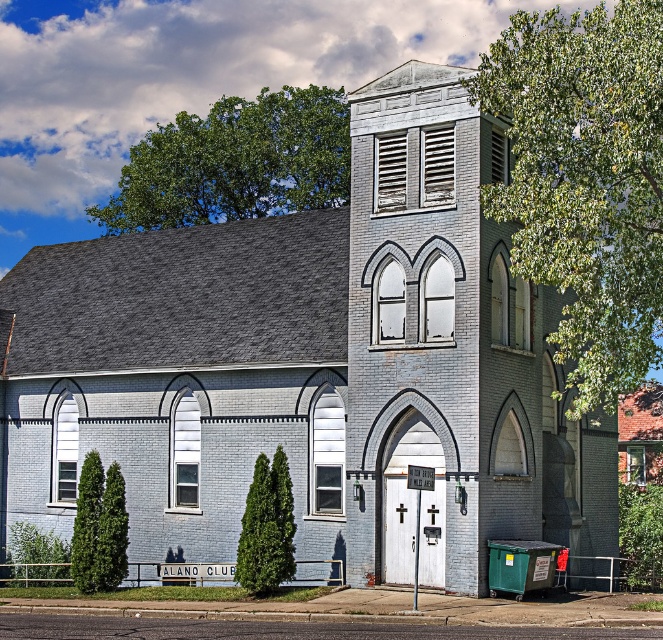
You are standing in front of the historic building and want to locate the green textured evergreen tree at center. Can you tell me where the point at coordinate [267,528] is located relative to the tree?

The point at coordinate [267,528] is located on the green textured evergreen tree at center.

You are standing in front of the historic building and want to know which tree is taller between the green leafy tree at upper right and the green textured evergreen tree at center. Can you determine which one is taller?

The green leafy tree at upper right is taller than the green textured evergreen tree at center according to the description.